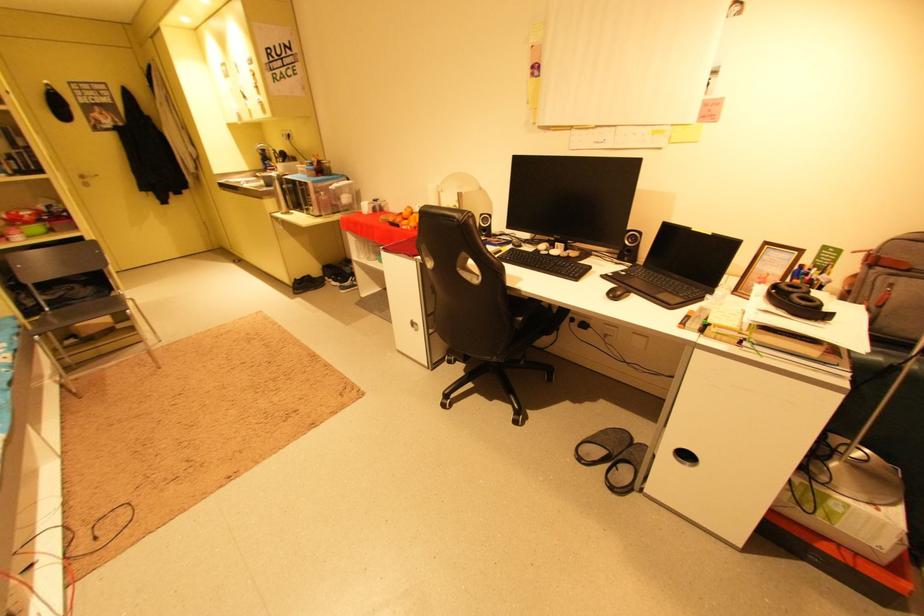
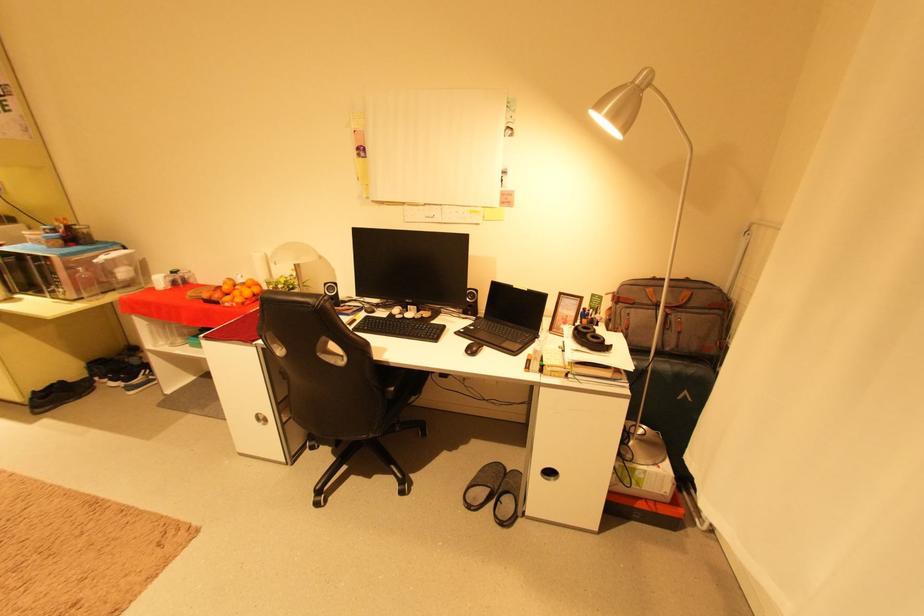
Where in the second image is the point corresponding to point 804,297 from the first image?

(596, 336)